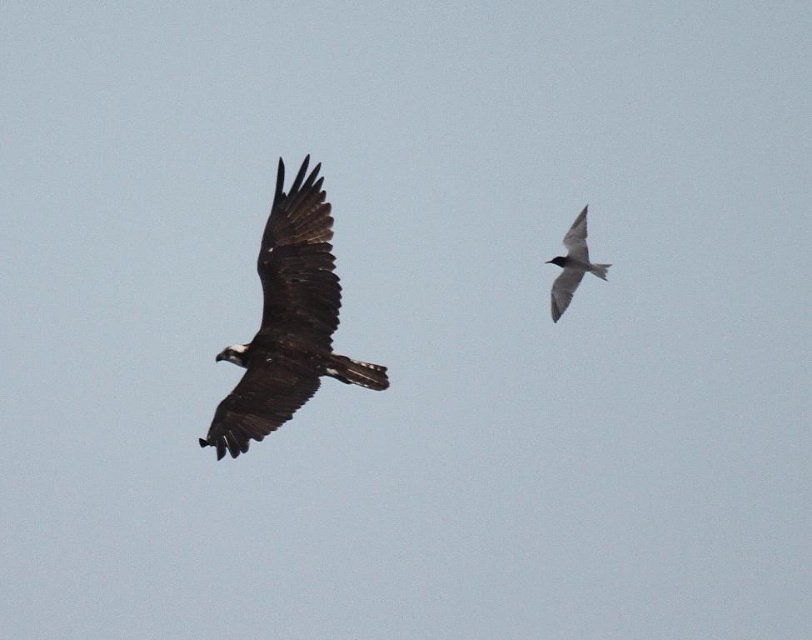
Based on the photo, you are a birdwatcher trying to identify the birds in the image. You notice a point at coordinates point (288, 321). Which bird does this point belong to?

The point (288, 321) belongs to the dark brown feathers at left, which is the large raptor, possibly an osprey.

You are an ornithologist observing two birds in flight. You notice the dark brown feathers at left and the gray matte bird at upper right. Which bird is positioned higher in the sky?

The gray matte bird at upper right is positioned higher in the sky than the dark brown feathers at left.

You are a birdwatcher observing two birds in flight. You notice the dark brown feathers at left and the gray matte bird at upper right. Which bird is positioned closer to you?

The dark brown feathers at left is closer to the viewer than the gray matte bird at upper right.